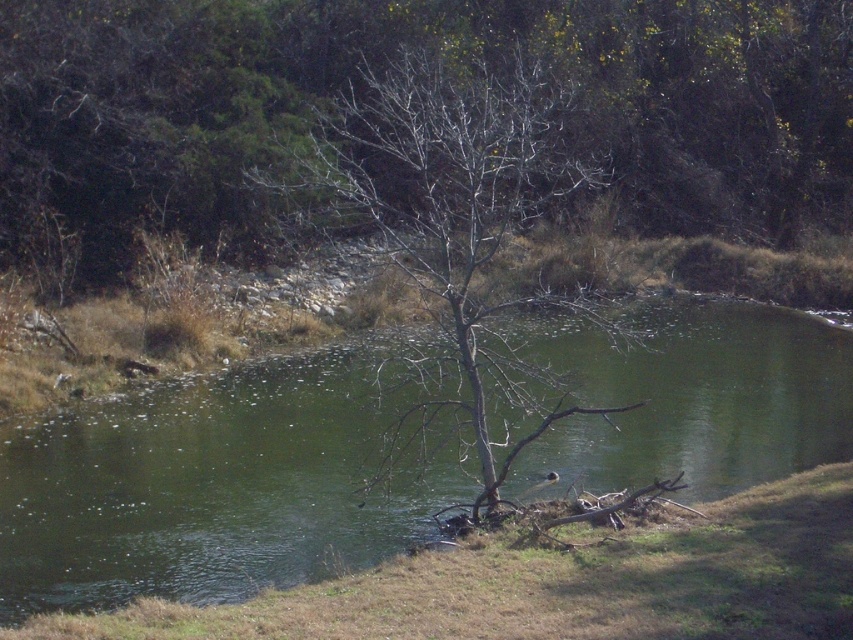
Question: Is bare branches at center closer to camera compared to bare wood tree at center?

Choices:
 (A) no
 (B) yes

Answer: (A)

Question: Which of the following is the closest to the observer?

Choices:
 (A) (454, 154)
 (B) (537, 451)

Answer: (A)

Question: Among these points, which one is nearest to the camera?

Choices:
 (A) (556, 24)
 (B) (196, 548)
 (C) (547, 192)

Answer: (B)

Question: Does bare branches at center appear on the left side of green water at center?

Choices:
 (A) no
 (B) yes

Answer: (B)

Question: Does bare branches at center have a smaller size compared to green water at center?

Choices:
 (A) no
 (B) yes

Answer: (A)

Question: Based on their relative distances, which object is farther from the bare wood tree at center?

Choices:
 (A) green water at center
 (B) bare branches at center

Answer: (B)